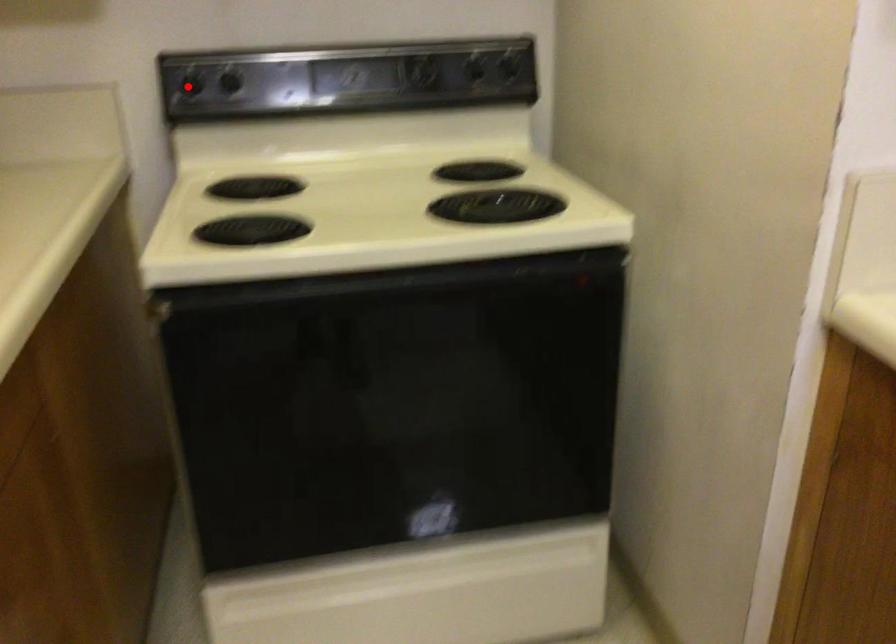
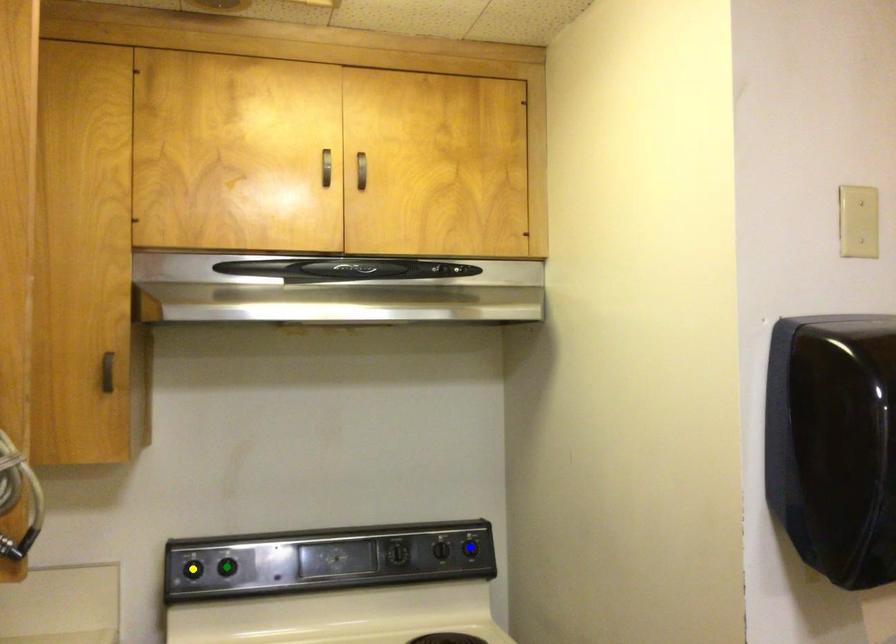
Question: I am providing you with two images of the same scene from different viewpoints. A red point is marked on the first image. You are given multiple points on the second image. In image 2, which mark is for the same physical point as the one in image 1?

Choices:
 (A) blue point
 (B) green point
 (C) yellow point

Answer: (C)